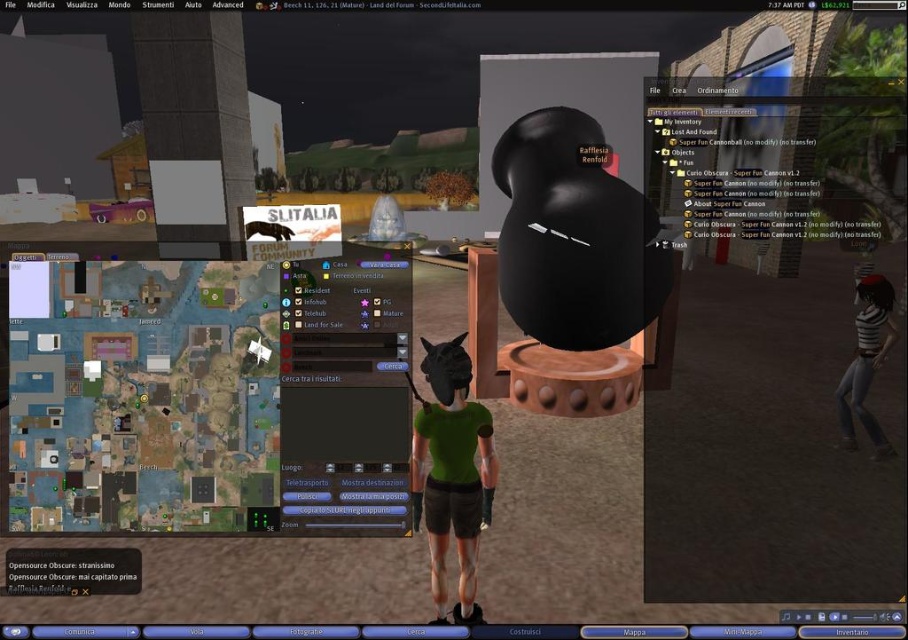
Question: From the image, what is the correct spatial relationship of matte green map at lower left in relation to green matte shirt at center?

Choices:
 (A) left
 (B) right

Answer: (A)

Question: Considering the real-world distances, which object is farthest from the matte green map at lower left?

Choices:
 (A) striped fabric shirt at right
 (B) green matte shirt at center

Answer: (A)

Question: Which point appears closest to the camera in this image?

Choices:
 (A) (875, 429)
 (B) (377, 525)
 (C) (442, 600)

Answer: (B)

Question: From the image, what is the correct spatial relationship of matte green map at lower left in relation to striped fabric shirt at right?

Choices:
 (A) above
 (B) below

Answer: (A)

Question: Which object appears farthest from the camera in this image?

Choices:
 (A) matte green map at lower left
 (B) striped fabric shirt at right
 (C) green matte shirt at center

Answer: (B)

Question: Can you confirm if matte green map at lower left is thinner than striped fabric shirt at right?

Choices:
 (A) no
 (B) yes

Answer: (A)